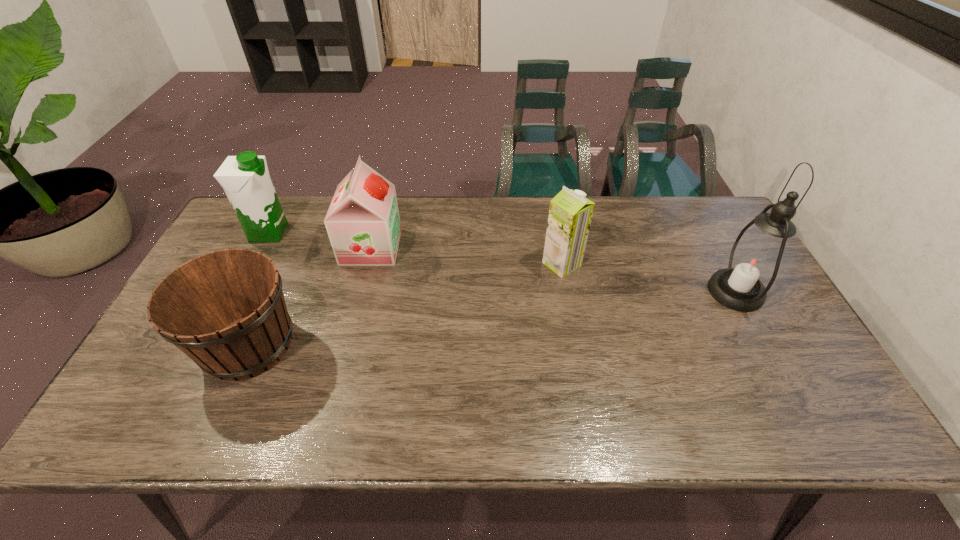
Identify the location of free space between the third object from right to left and the fourth object from left to right. The height and width of the screenshot is (540, 960). (467, 255).

The width and height of the screenshot is (960, 540). I want to click on vacant space that's between the rightmost soya milk and the shortest object, so click(405, 304).

Find the location of a particular element. This screenshot has height=540, width=960. unoccupied area between the leftmost soya milk and the rightmost object is located at coordinates (502, 262).

I want to click on vacant space that is in between the leftmost soya milk and the second soya milk from left to right, so [320, 240].

Locate an element on the screen. The width and height of the screenshot is (960, 540). empty space between the oil lamp and the rightmost soya milk is located at coordinates (649, 278).

Where is `unoccupied position between the second soya milk from right to left and the rightmost soya milk`? Image resolution: width=960 pixels, height=540 pixels. unoccupied position between the second soya milk from right to left and the rightmost soya milk is located at coordinates (467, 255).

Image resolution: width=960 pixels, height=540 pixels. I want to click on free spot between the rightmost soya milk and the second soya milk from right to left, so click(467, 255).

This screenshot has width=960, height=540. Find the location of `vacant area that lies between the second object from right to left and the rightmost object`. vacant area that lies between the second object from right to left and the rightmost object is located at coordinates (649, 278).

Where is `blank region between the third object from left to right and the shortest object`? The height and width of the screenshot is (540, 960). blank region between the third object from left to right and the shortest object is located at coordinates (310, 295).

At what (x,y) coordinates should I click in order to perform the action: click on object that is the second closest to the rightmost object. Please return your answer as a coordinate pair (x, y). This screenshot has width=960, height=540. Looking at the image, I should click on (363, 224).